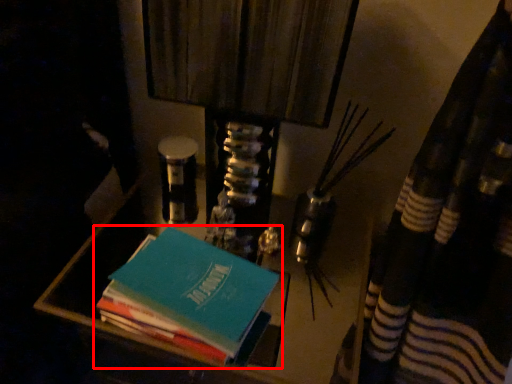
Question: Where is book (annotated by the red box) located in relation to vanity in the image?

Choices:
 (A) left
 (B) right

Answer: (A)